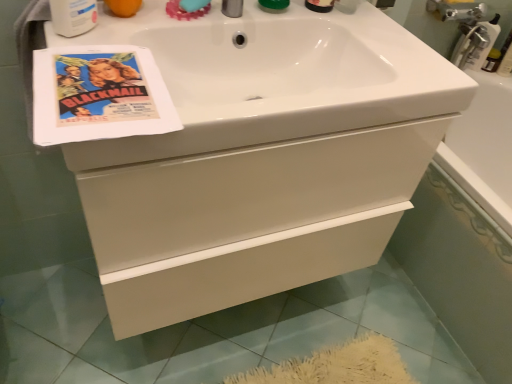
Question: Does white glossy cabinet at center have a smaller size compared to white plastic mouthwash at upper left?

Choices:
 (A) yes
 (B) no

Answer: (B)

Question: Considering the relative sizes of white glossy cabinet at center and white plastic mouthwash at upper left in the image provided, is white glossy cabinet at center thinner than white plastic mouthwash at upper left?

Choices:
 (A) no
 (B) yes

Answer: (A)

Question: Does white glossy cabinet at center have a lesser height compared to white plastic mouthwash at upper left?

Choices:
 (A) no
 (B) yes

Answer: (A)

Question: Considering the relative positions of white glossy cabinet at center and white plastic mouthwash at upper left in the image provided, is white glossy cabinet at center to the left of white plastic mouthwash at upper left from the viewer's perspective?

Choices:
 (A) yes
 (B) no

Answer: (B)

Question: Is white glossy cabinet at center beside white plastic mouthwash at upper left?

Choices:
 (A) no
 (B) yes

Answer: (A)

Question: In the image, is white plastic mouthwash at upper left on the left side or the right side of white glossy cabinet at center?

Choices:
 (A) right
 (B) left

Answer: (B)

Question: Looking at the image, does white plastic mouthwash at upper left seem bigger or smaller compared to white glossy cabinet at center?

Choices:
 (A) big
 (B) small

Answer: (B)

Question: Would you say white plastic mouthwash at upper left is inside or outside white glossy cabinet at center?

Choices:
 (A) outside
 (B) inside

Answer: (A)

Question: From the image's perspective, relative to white glossy cabinet at center, is white plastic mouthwash at upper left above or below?

Choices:
 (A) above
 (B) below

Answer: (A)

Question: From the image's perspective, is white glossy bathtub at lower right positioned above or below teal rubber soap at upper center?

Choices:
 (A) above
 (B) below

Answer: (B)

Question: Visually, is white glossy bathtub at lower right positioned to the left or to the right of teal rubber soap at upper center?

Choices:
 (A) left
 (B) right

Answer: (B)

Question: Choose the correct answer: Is white glossy bathtub at lower right inside teal rubber soap at upper center or outside it?

Choices:
 (A) outside
 (B) inside

Answer: (A)

Question: Considering the positions of point (x=494, y=223) and point (x=197, y=6), is point (x=494, y=223) closer or farther from the camera than point (x=197, y=6)?

Choices:
 (A) closer
 (B) farther

Answer: (B)

Question: Do you think white glossy cabinet at center is within vintage paper flyer at upper left, or outside of it?

Choices:
 (A) inside
 (B) outside

Answer: (B)

Question: Is white glossy cabinet at center wider or thinner than vintage paper flyer at upper left?

Choices:
 (A) thin
 (B) wide

Answer: (B)